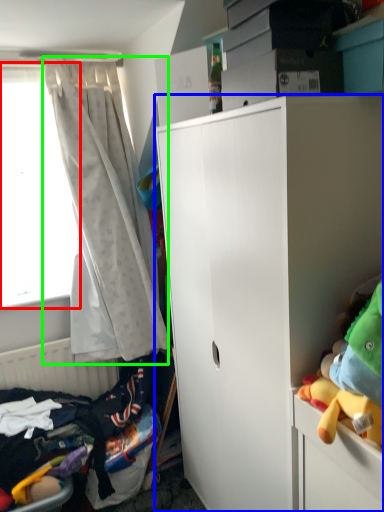
Question: Which is nearer to the window screen (highlighted by a red box)? cabinetry (highlighted by a blue box) or curtain (highlighted by a green box).

Choices:
 (A) cabinetry
 (B) curtain

Answer: (B)